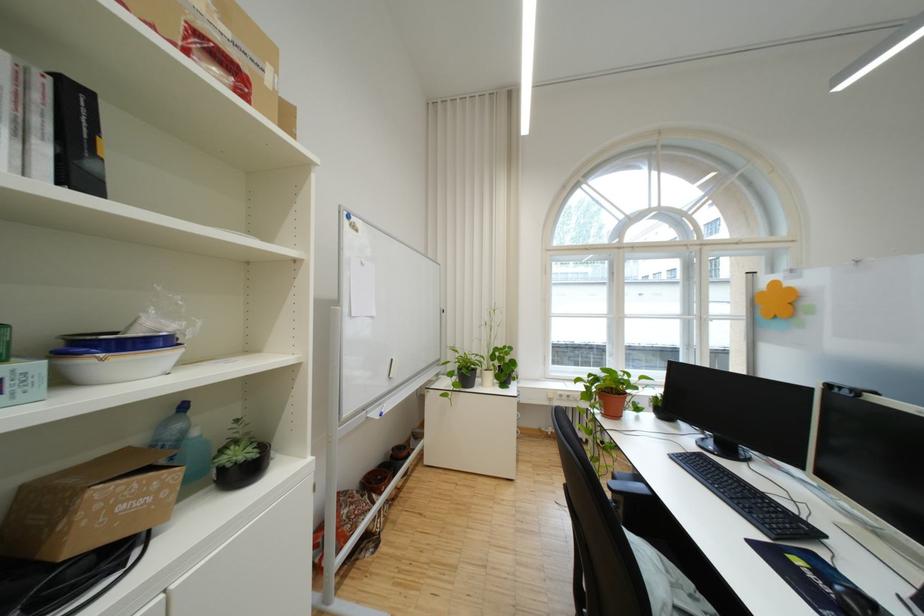
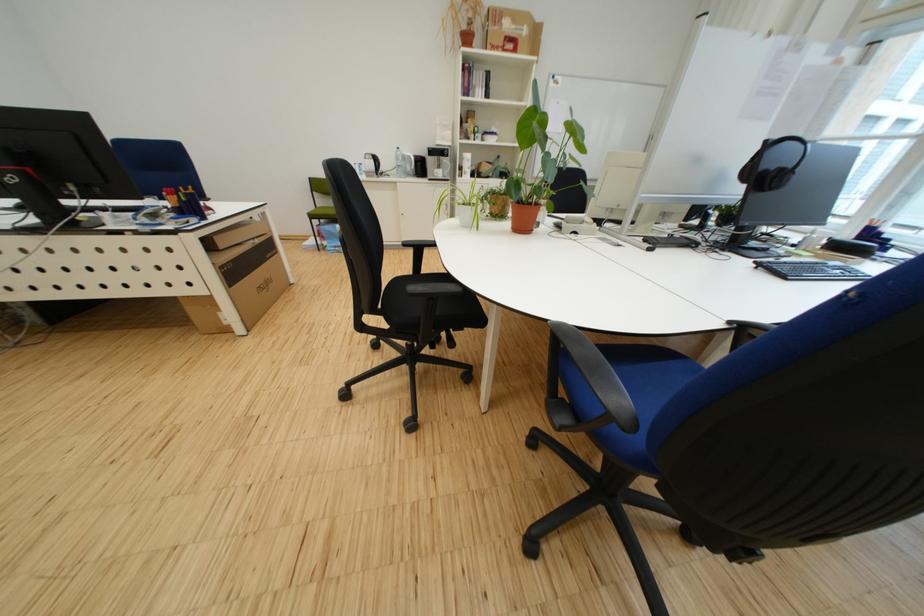
Question: I am providing you with two images of the same scene from different viewpoints. Please identify which objects are invisible in image2.

Choices:
 (A) machine control buttons
 (B) green chair sitting surface
 (C) black keyboard
 (D) small potted plant

Answer: (C)